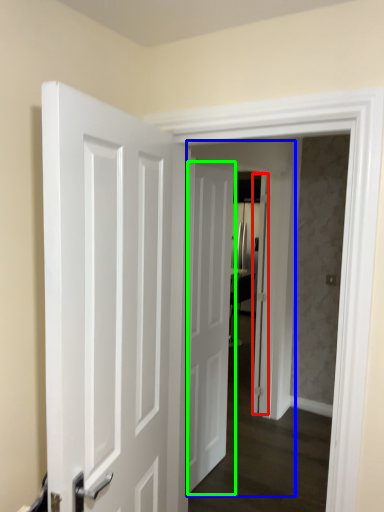
Question: Which object is positioned closest to door (highlighted by a red box)? Select from screen door (highlighted by a blue box) and door (highlighted by a green box).

Choices:
 (A) screen door
 (B) door

Answer: (A)